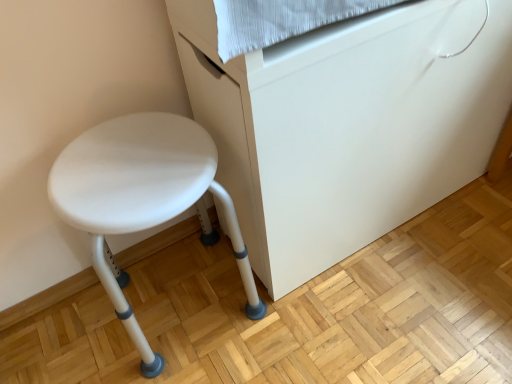
Image resolution: width=512 pixels, height=384 pixels. I want to click on vacant area on top of white plastic stool at left (from a real-world perspective), so click(x=123, y=168).